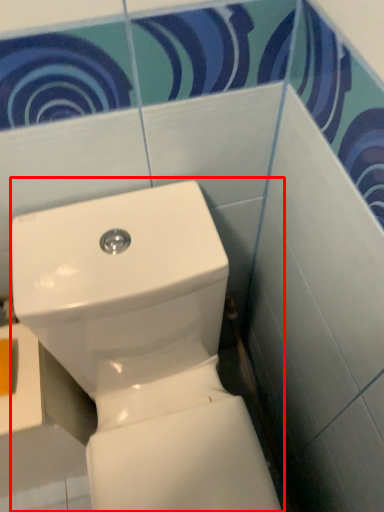
Question: From the image's perspective, what is the correct spatial relationship of toilet (annotated by the red box) in relation to toilet paper?

Choices:
 (A) above
 (B) below

Answer: (B)